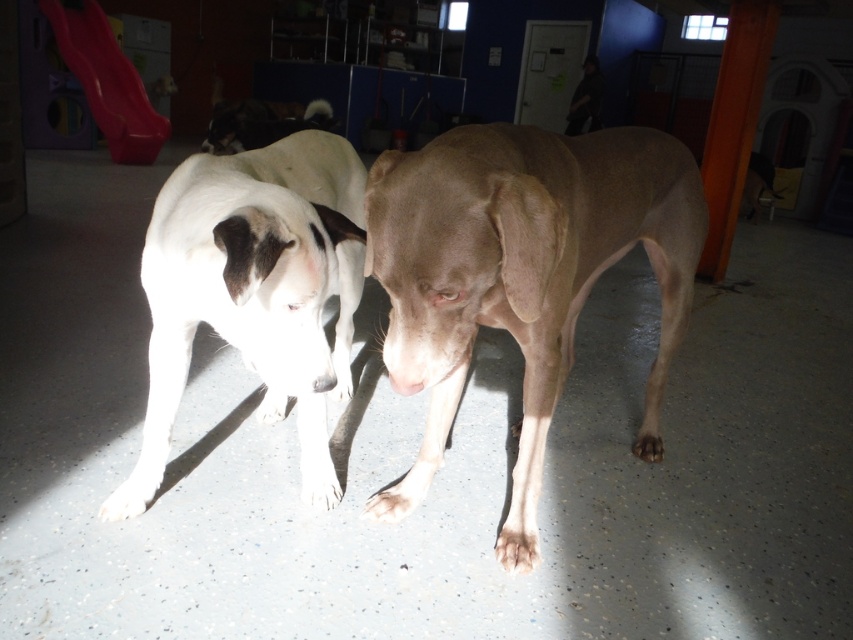
Question: Which object is positioned farthest from the white smooth fur dog at left?

Choices:
 (A) smooth tan dog at center
 (B) white fur dog at upper center
 (C) black matte dog at center

Answer: (C)

Question: Which object appears farthest from the camera in this image?

Choices:
 (A) black matte dog at center
 (B) white smooth fur dog at left
 (C) smooth tan dog at center

Answer: (A)

Question: Is smooth tan dog at center bigger than white smooth fur dog at left?

Choices:
 (A) no
 (B) yes

Answer: (B)

Question: Can you confirm if smooth tan dog at center is wider than white smooth fur dog at left?

Choices:
 (A) yes
 (B) no

Answer: (A)

Question: In this image, where is white smooth fur dog at left located relative to black matte dog at center?

Choices:
 (A) below
 (B) above

Answer: (A)

Question: Which point is closer to the camera?

Choices:
 (A) (598, 86)
 (B) (241, 300)
 (C) (413, 502)

Answer: (B)